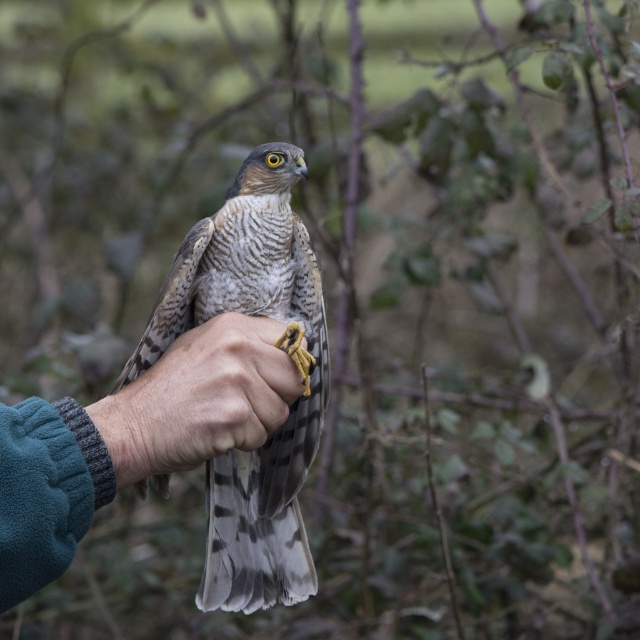
In the scene shown: You are a falconer assessing the space between your hand and the falcon. Given that your hand is wearing a smooth leather glove at center, can the falcon, speckled feathered falcon at center, perch comfortably without touching the glove?

The speckled feathered falcon at center is taller than the smooth leather glove at center, so there is enough vertical space for the falcon to perch comfortably without touching the glove.

You are a nature photographer trying to capture a clear shot of the speckled feathered falcon at center and the smooth leather glove at center. Based on their positions, which object is positioned to the right side of the other?

The speckled feathered falcon at center is to the right of the smooth leather glove at center.

You are a wildlife photographer aiming to capture a close shot of the speckled feathered falcon at center. Your camera lens has a minimum focusing distance of 8 inches. Can you take the photo without moving either the falcon or the teal fleece arm at center?

The speckled feathered falcon at center is 7.76 inches away from the teal fleece arm at center. Since the minimum focusing distance is 8 inches, the camera cannot focus properly at this distance. You need to move either the falcon or the arm to increase the distance to at least 8 inches.